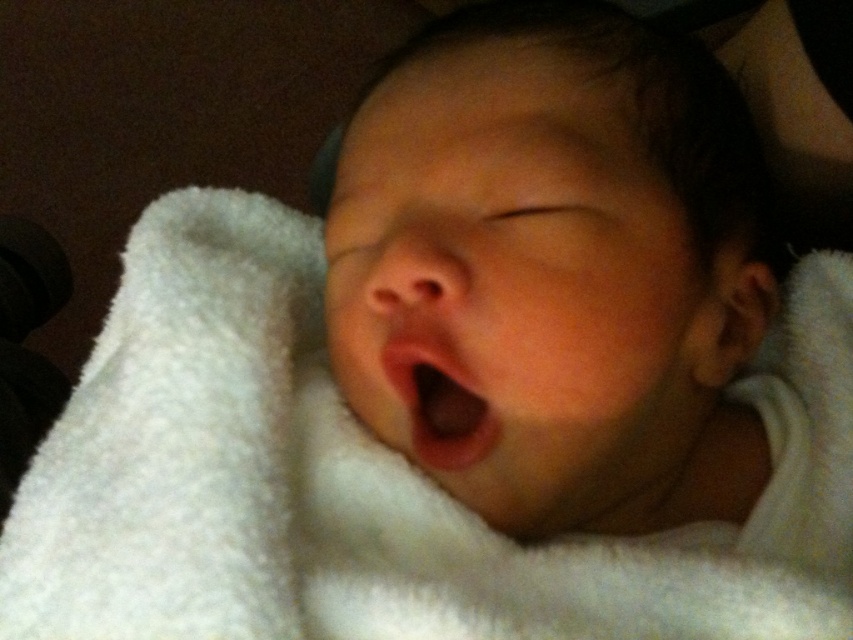
Based on the scene description, can you determine if the white fluffy blanket at center is wider than the pink smooth flesh at center?

The white fluffy blanket at center might be wider than pink smooth flesh at center according to the description.

You are a photographer trying to capture the newborn baby in the image. The camera is positioned at point A. The focus point is set at the center of the image. Will the white fluffy blanket at center be in focus?

The white fluffy blanket at center is located at point (355,477), which is slightly off the center of the image. Since the focus point is set at the center, the white fluffy blanket at center may not be in focus.